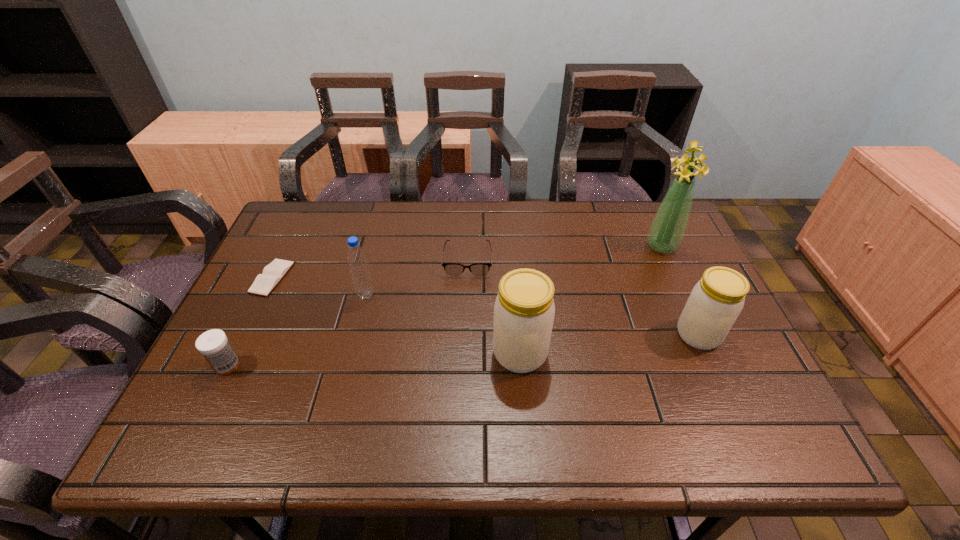
Where is `empty location between the right jar and the second shortest object`? empty location between the right jar and the second shortest object is located at coordinates (583, 297).

Identify the location of vacant area between the spectacles and the fifth object from right to left. The image size is (960, 540). (417, 277).

You are a GUI agent. You are given a task and a screenshot of the screen. Output one action in this format:
    pyautogui.click(x=<x>, y=<y>)
    Task: Click on the vacant space that is in between the medicine and the right jar
    Image resolution: width=960 pixels, height=540 pixels.
    Given the screenshot: What is the action you would take?
    pyautogui.click(x=463, y=350)

Where is `unoccupied position between the taller jar and the medicine`? unoccupied position between the taller jar and the medicine is located at coordinates (373, 360).

In order to click on free space between the left jar and the medicine in this screenshot , I will do `click(373, 360)`.

The image size is (960, 540). In order to click on free space between the taller jar and the spectacles in this screenshot , I will do `click(493, 306)`.

Identify the location of vacant area that lies between the third shortest object and the bouquet. (444, 306).

Locate an element on the screen. The image size is (960, 540). object that is the second closest one to the shortest object is located at coordinates (357, 260).

Find the location of a particular element. object identified as the fourth closest to the shortest object is located at coordinates (524, 310).

Where is `free spot that satisfies the following two spatial constraints: 1. on the face of the right jar; 2. on the right side of the spectacles`? Image resolution: width=960 pixels, height=540 pixels. free spot that satisfies the following two spatial constraints: 1. on the face of the right jar; 2. on the right side of the spectacles is located at coordinates (466, 335).